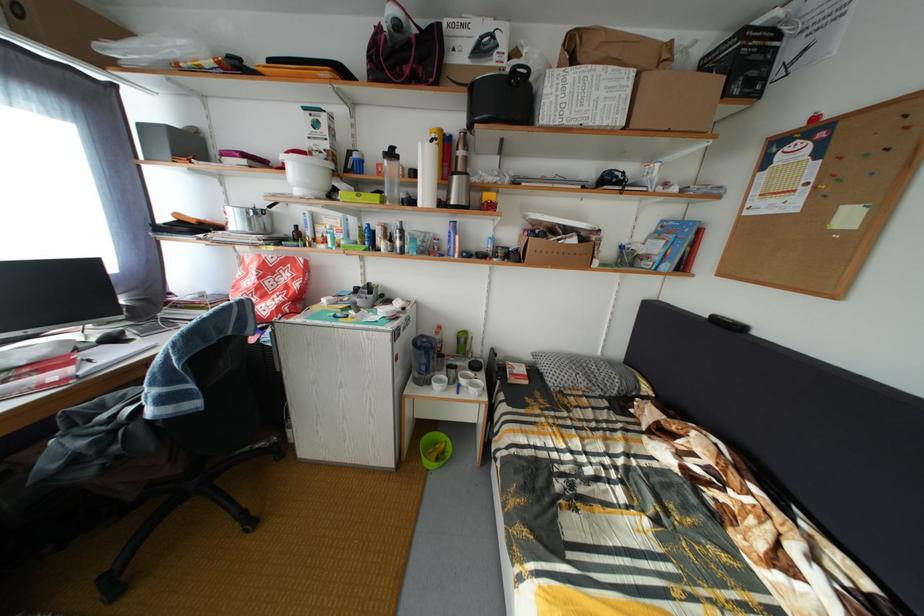
I want to click on small red book, so click(x=38, y=376).